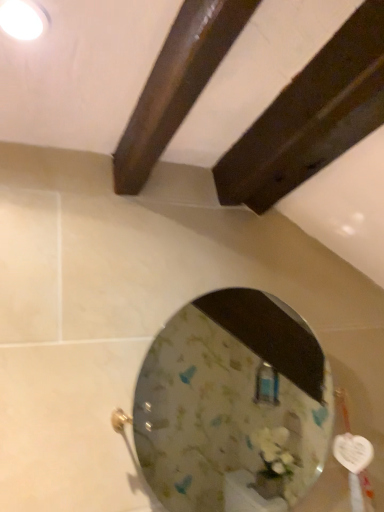
Where is `white glossy light fixture at upper left`? This screenshot has height=512, width=384. white glossy light fixture at upper left is located at coordinates (23, 19).

Describe the element at coordinates (23, 19) in the screenshot. I see `white glossy light fixture at upper left` at that location.

The image size is (384, 512). What do you see at coordinates (232, 400) in the screenshot? I see `clear glass mirror at center` at bounding box center [232, 400].

Locate an element on the screen. The height and width of the screenshot is (512, 384). clear glass mirror at center is located at coordinates (232, 400).

I want to click on white glossy light fixture at upper left, so click(23, 19).

Which object is positioned more to the right, white glossy light fixture at upper left or clear glass mirror at center?

From the viewer's perspective, clear glass mirror at center appears more on the right side.

Which object is further away from the camera taking this photo, white glossy light fixture at upper left or clear glass mirror at center?

clear glass mirror at center is more distant.

Does point (19, 32) appear closer or farther from the camera than point (212, 352)?

Point (19, 32).

From the image's perspective, does white glossy light fixture at upper left appear higher than clear glass mirror at center?

Yes, from the image's perspective, white glossy light fixture at upper left is on top of clear glass mirror at center.

From a real-world perspective, is white glossy light fixture at upper left below clear glass mirror at center?

No, from a real-world perspective, white glossy light fixture at upper left is not under clear glass mirror at center.

Which object is thinner, white glossy light fixture at upper left or clear glass mirror at center?

Thinner between the two is white glossy light fixture at upper left.

Based on the photo, considering the relative sizes of white glossy light fixture at upper left and clear glass mirror at center in the image provided, is white glossy light fixture at upper left shorter than clear glass mirror at center?

Yes, white glossy light fixture at upper left is shorter than clear glass mirror at center.

Considering the sizes of objects white glossy light fixture at upper left and clear glass mirror at center in the image provided, who is bigger, white glossy light fixture at upper left or clear glass mirror at center?

clear glass mirror at center is bigger.

Is white glossy light fixture at upper left completely or partially outside of clear glass mirror at center?

Yes, white glossy light fixture at upper left is not within clear glass mirror at center.

Are white glossy light fixture at upper left and clear glass mirror at center located far from each other?

Indeed, white glossy light fixture at upper left is not near clear glass mirror at center.

Is white glossy light fixture at upper left oriented towards clear glass mirror at center?

No, white glossy light fixture at upper left is not facing towards clear glass mirror at center.

How far apart are white glossy light fixture at upper left and clear glass mirror at center?

They are 6.39 feet apart.

I want to click on mirror below the white glossy light fixture at upper left (from the image's perspective), so click(x=232, y=400).

Visually, is clear glass mirror at center positioned to the left or to the right of white glossy light fixture at upper left?

In the image, clear glass mirror at center appears on the right side of white glossy light fixture at upper left.

Which is in front, clear glass mirror at center or white glossy light fixture at upper left?

white glossy light fixture at upper left is more forward.

Which is less distant, (159, 453) or (27, 10)?

The point (27, 10) is in front.

Based on the photo, from the image's perspective, would you say clear glass mirror at center is positioned over white glossy light fixture at upper left?

No, from the image's perspective, clear glass mirror at center is not above white glossy light fixture at upper left.

From a real-world perspective, is clear glass mirror at center physically below white glossy light fixture at upper left?

Indeed, from a real-world perspective, clear glass mirror at center is positioned beneath white glossy light fixture at upper left.

Is clear glass mirror at center thinner than white glossy light fixture at upper left?

No, clear glass mirror at center is not thinner than white glossy light fixture at upper left.

Which of these two, clear glass mirror at center or white glossy light fixture at upper left, stands taller?

clear glass mirror at center is taller.

Does clear glass mirror at center have a larger size compared to white glossy light fixture at upper left?

Correct, clear glass mirror at center is larger in size than white glossy light fixture at upper left.

Which is correct: clear glass mirror at center is inside white glossy light fixture at upper left, or outside of it?

clear glass mirror at center is located beyond the bounds of white glossy light fixture at upper left.

Is clear glass mirror at center far from white glossy light fixture at upper left?

That's right, there is a large distance between clear glass mirror at center and white glossy light fixture at upper left.

Could you tell me if clear glass mirror at center is turned towards white glossy light fixture at upper left?

No, clear glass mirror at center is not facing towards white glossy light fixture at upper left.

How many degrees apart are the facing directions of clear glass mirror at center and white glossy light fixture at upper left?

There is a 1.18-degree angle between the facing directions of clear glass mirror at center and white glossy light fixture at upper left.

In order to click on mirror on the right of white glossy light fixture at upper left in this screenshot , I will do `click(232, 400)`.

Locate an element on the screen. This screenshot has width=384, height=512. light fixture above the clear glass mirror at center (from a real-world perspective) is located at coordinates (23, 19).

Where is `mirror lying behind the white glossy light fixture at upper left`? This screenshot has width=384, height=512. mirror lying behind the white glossy light fixture at upper left is located at coordinates (232, 400).